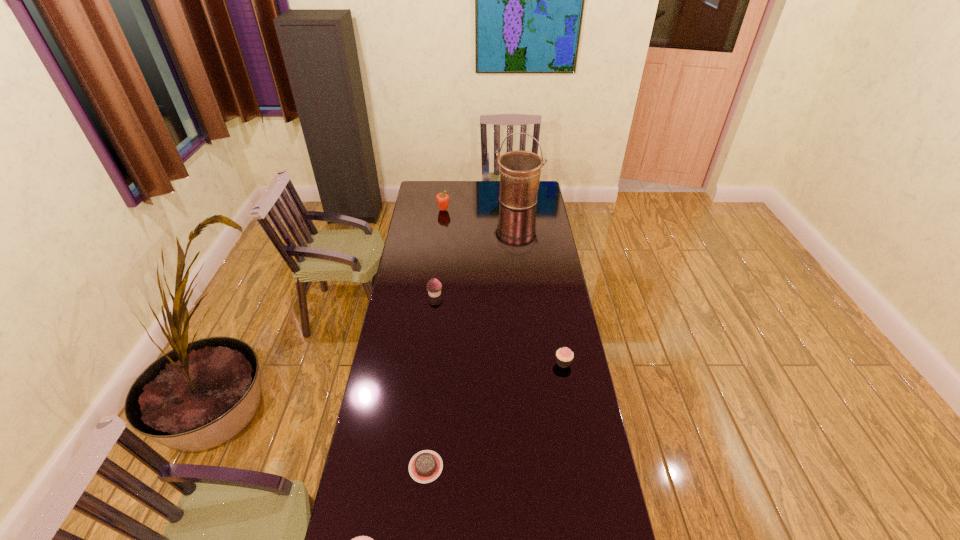
You are a GUI agent. You are given a task and a screenshot of the screen. Output one action in this format:
    pyautogui.click(x=<x>, y=<y>)
    Task: Click on the vacant space at the right edge of the desktop
    
    Given the screenshot: What is the action you would take?
    pyautogui.click(x=557, y=411)

In the image, there is a desktop. Identify the location of vacant space at the far left corner. (433, 193).

The image size is (960, 540). I want to click on free space that is in between the rightmost cupcake and the fifth shortest object, so click(503, 286).

Image resolution: width=960 pixels, height=540 pixels. Identify the location of free area in between the second cupcake from left to right and the bucket. (476, 247).

You are a GUI agent. You are given a task and a screenshot of the screen. Output one action in this format:
    pyautogui.click(x=<x>, y=<y>)
    Task: Click on the vacant point located between the fifth shortest object and the tallest object
    
    Given the screenshot: What is the action you would take?
    pyautogui.click(x=481, y=205)

The width and height of the screenshot is (960, 540). What are the coordinates of `free point between the tallest object and the fifth farthest object` in the screenshot? It's located at (472, 333).

Locate an element on the screen. The width and height of the screenshot is (960, 540). free point between the bucket and the second cupcake from right to left is located at coordinates (476, 247).

Point out which object is positioned as the second nearest to the second tallest object. Please provide its 2D coordinates. Your answer should be formatted as a tuple, i.e. [(x, y)], where the tuple contains the x and y coordinates of a point satisfying the conditions above.

[(434, 287)]

Where is `object that can be found as the closest to the leftmost cupcake`? This screenshot has height=540, width=960. object that can be found as the closest to the leftmost cupcake is located at coordinates (425, 466).

The height and width of the screenshot is (540, 960). Find the location of `cupcake that is the third closest to the pepper`. cupcake that is the third closest to the pepper is located at coordinates (361, 539).